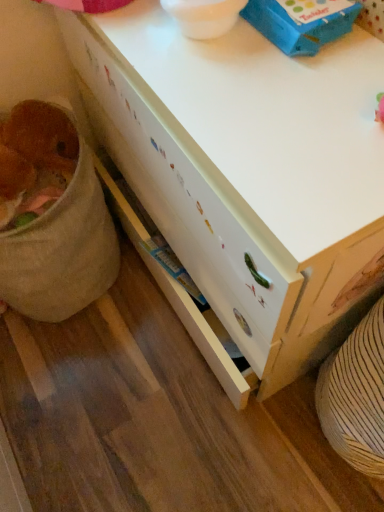
Question: Considering the positions of fuzzy brown stuffed animal at lower left and white wood desk at center in the image, is fuzzy brown stuffed animal at lower left bigger or smaller than white wood desk at center?

Choices:
 (A) big
 (B) small

Answer: (B)

Question: From a real-world perspective, is fuzzy brown stuffed animal at lower left above or below white wood desk at center?

Choices:
 (A) below
 (B) above

Answer: (B)

Question: Estimate the real-world distances between objects in this image. Which object is closer to the white wood desk at center?

Choices:
 (A) fuzzy brown stuffed animal at lower left
 (B) blue cardboard box at upper center

Answer: (B)

Question: Estimate the real-world distances between objects in this image. Which object is closer to the white wood desk at center?

Choices:
 (A) fuzzy brown stuffed animal at lower left
 (B) blue cardboard box at upper center

Answer: (B)